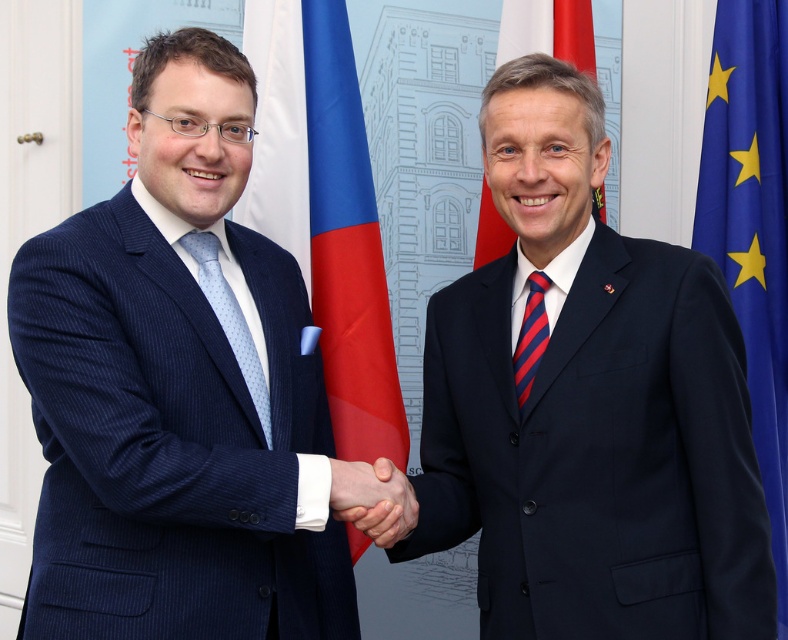
You are a photographer trying to capture the European Union flag in the image. The flag is located at point (753, 225). What object is at that coordinate?

The blue fabric flag at right is located at point (753, 225).

You are an event planner arranging a diplomatic ceremony. You need to place a new flag that is 1.5 meters wide between the blue fabric flag at right and the polished wood flag at upper center. Considering their widths, which existing flag should the new flag be placed next to to maintain proper proportions?

The blue fabric flag at right has a lesser width compared to the polished wood flag at upper center. To maintain proper proportions, the new 1.5 meter wide flag should be placed next to the polished wood flag at upper center since it is wider and the new flag can better match its scale.

You are standing in the room where the two men are shaking hands. You want to take a photo of the point at coordinate point (153, 627). Is this point within the camera frame?

The point (153, 627) is 5.63 feet away from camera, so yes, it is within the camera frame.